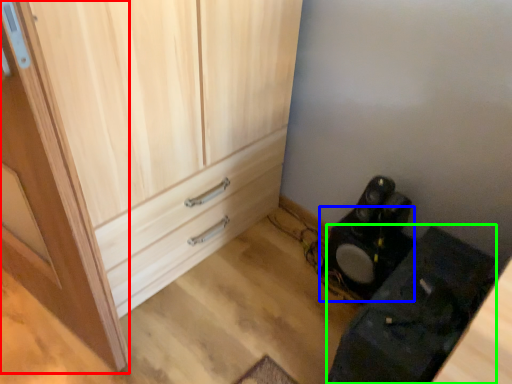
Question: Estimate the real-world distances between objects in this image. Which object is farther from door (highlighted by a red box), speaker (highlighted by a blue box) or furniture (highlighted by a green box)?

Choices:
 (A) speaker
 (B) furniture

Answer: (A)